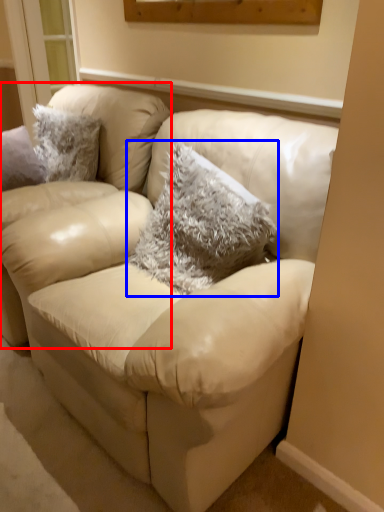
Question: Which point is further to the camera, chair (highlighted by a red box) or throw pillow (highlighted by a blue box)?

Choices:
 (A) chair
 (B) throw pillow

Answer: (A)